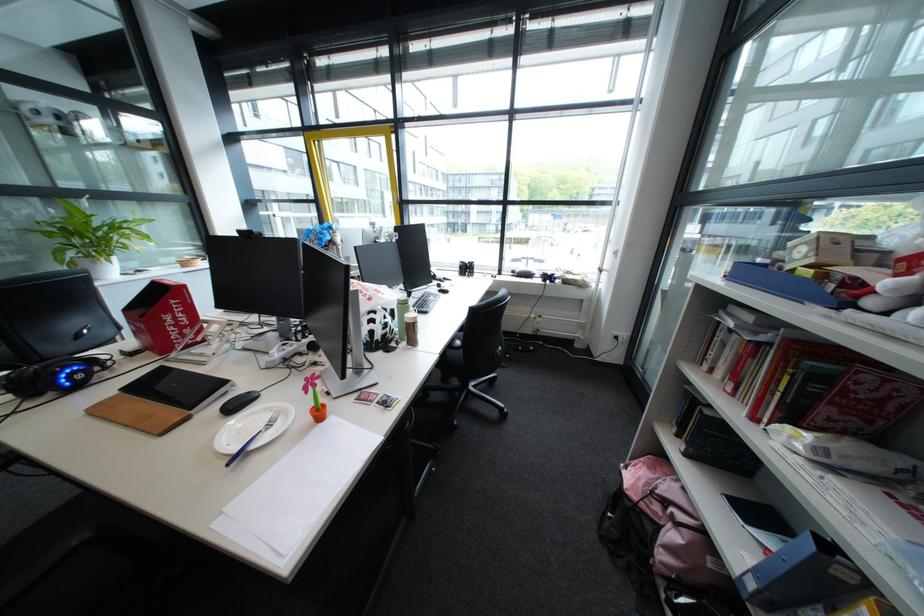
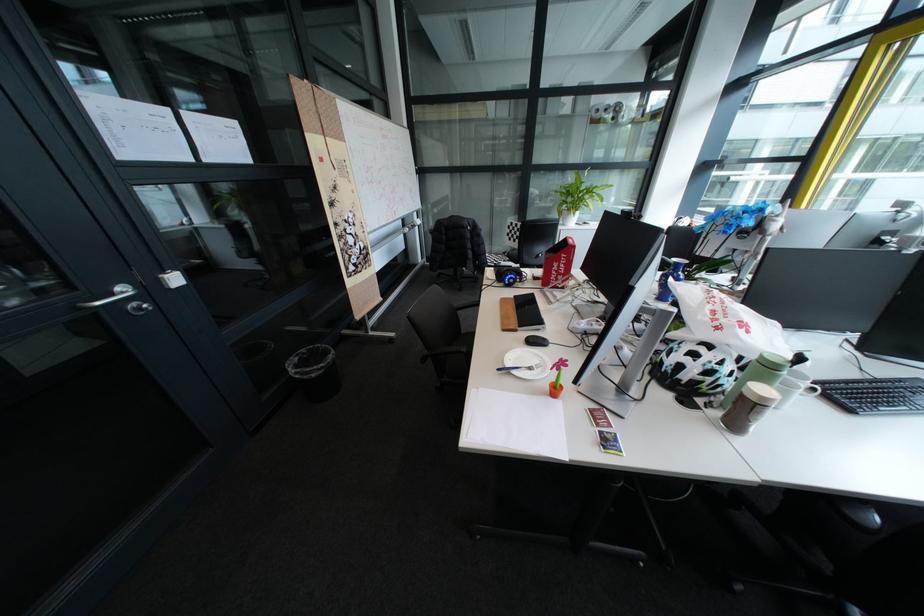
In the second image, find the point that corresponds to pixel 411 301 in the first image.

(774, 357)